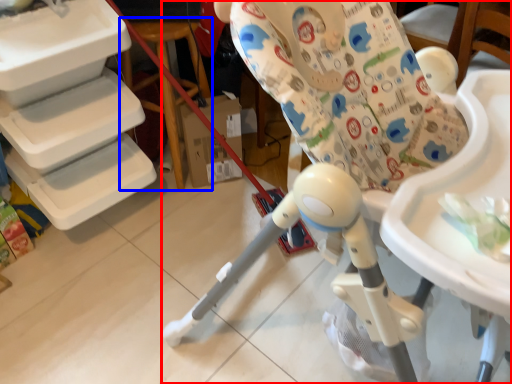
Question: Which of the following is the farthest to the observer, chair (highlighted by a red box) or table (highlighted by a blue box)?

Choices:
 (A) chair
 (B) table

Answer: (B)